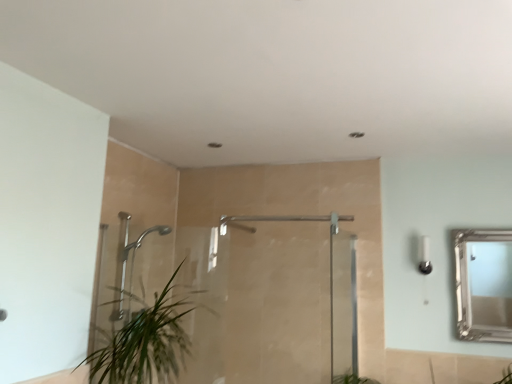
Question: Is polished chrome shower head at left, the 1th shower in the left-to-right sequence, positioned far away from green leafy plant at lower left?

Choices:
 (A) no
 (B) yes

Answer: (A)

Question: Is green leafy plant at lower left completely or partially inside polished chrome shower head at left, placed as the second shower when sorted from right to left?

Choices:
 (A) yes
 (B) no

Answer: (B)

Question: Does polished chrome shower head at left, the 1th shower in the left-to-right sequence, have a smaller size compared to green leafy plant at lower left?

Choices:
 (A) no
 (B) yes

Answer: (B)

Question: Is polished chrome shower head at left, the 1th shower in the left-to-right sequence, outside green leafy plant at lower left?

Choices:
 (A) yes
 (B) no

Answer: (A)

Question: From a real-world perspective, is polished chrome shower head at left, the 1th shower in the left-to-right sequence, on top of green leafy plant at lower left?

Choices:
 (A) yes
 (B) no

Answer: (A)

Question: From a real-world perspective, is clear glass shower door at left, the 2th screen door when ordered from right to left, physically located above or below satin nickel shower at center, acting as the 1th shower starting from the right?

Choices:
 (A) below
 (B) above

Answer: (A)

Question: Is clear glass shower door at left, the 2th screen door when ordered from right to left, taller or shorter than satin nickel shower at center, acting as the 1th shower starting from the right?

Choices:
 (A) short
 (B) tall

Answer: (B)

Question: From the image's perspective, is clear glass shower door at left, the first screen door positioned from the left, located above or below satin nickel shower at center, the second shower positioned from the left?

Choices:
 (A) below
 (B) above

Answer: (A)

Question: Is point (352, 326) positioned closer to the camera than point (223, 231)?

Choices:
 (A) closer
 (B) farther

Answer: (B)

Question: Is clear glass door at center, the second screen door viewed from the left, inside or outside of silver/glass mirror at upper right?

Choices:
 (A) outside
 (B) inside

Answer: (A)

Question: From a real-world perspective, is clear glass door at center, the second screen door viewed from the left, positioned above or below silver/glass mirror at upper right?

Choices:
 (A) below
 (B) above

Answer: (A)

Question: Is clear glass door at center, which appears as the 1th screen door when viewed from the right, wider or thinner than silver/glass mirror at upper right?

Choices:
 (A) thin
 (B) wide

Answer: (A)

Question: In the image, is clear glass door at center, the second screen door viewed from the left, positioned in front of or behind silver/glass mirror at upper right?

Choices:
 (A) behind
 (B) front

Answer: (B)

Question: From a real-world perspective, is clear glass door at center, which appears as the 1th screen door when viewed from the right, positioned above or below green leafy plant at lower left?

Choices:
 (A) above
 (B) below

Answer: (A)

Question: Is clear glass door at center, which appears as the 1th screen door when viewed from the right, wider or thinner than green leafy plant at lower left?

Choices:
 (A) wide
 (B) thin

Answer: (B)